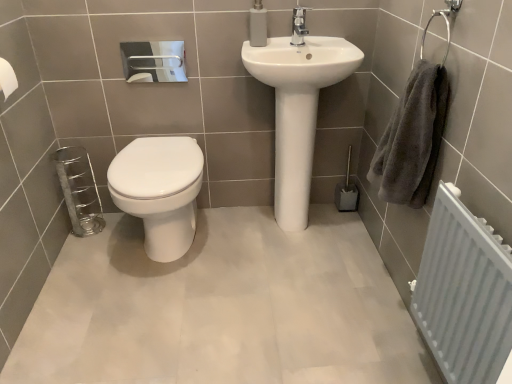
Question: Based on their sizes in the image, would you say gray fluffy towel at right is bigger or smaller than white glossy sink at center?

Choices:
 (A) small
 (B) big

Answer: (A)

Question: In the image, is gray fluffy towel at right on the left side or the right side of white glossy sink at center?

Choices:
 (A) left
 (B) right

Answer: (B)

Question: Which object is positioned closest to the white glossy toilet at center?

Choices:
 (A) gray fluffy towel at right
 (B) polished chrome faucet at upper center
 (C) white matte toilet paper at left
 (D) white textured radiator at right
 (E) white glossy sink at center

Answer: (E)

Question: Considering the real-world distances, which object is closest to the white matte toilet paper at left?

Choices:
 (A) polished chrome faucet at upper center
 (B) white textured radiator at right
 (C) white glossy toilet at center
 (D) white glossy sink at center
 (E) gray fluffy towel at right

Answer: (C)